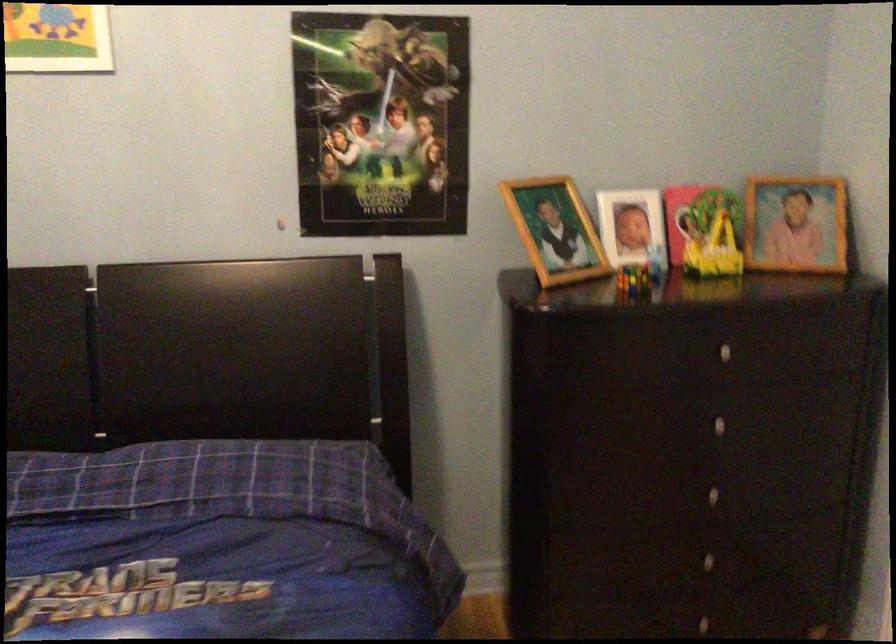
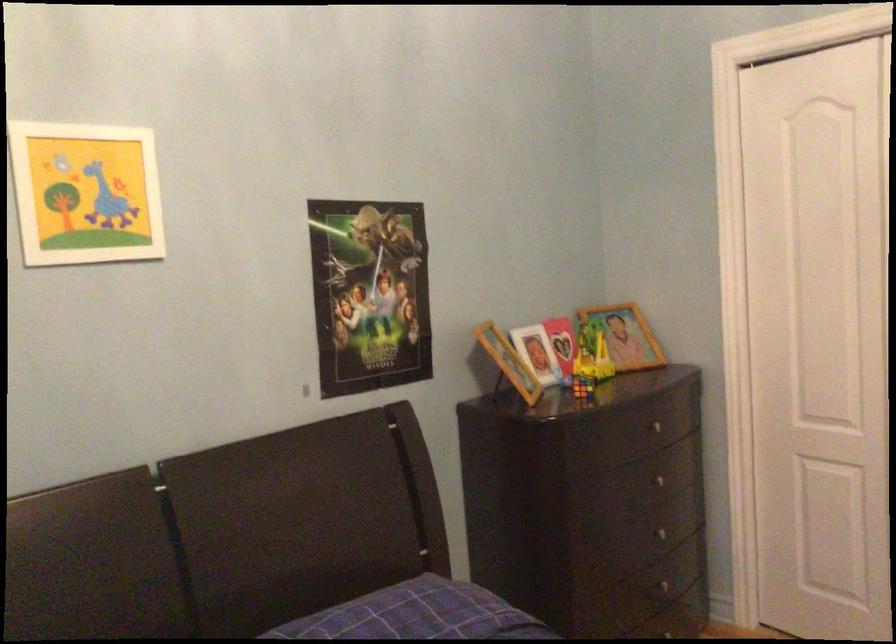
In the second image, find the point that corresponds to (711,486) in the first image.

(667, 532)